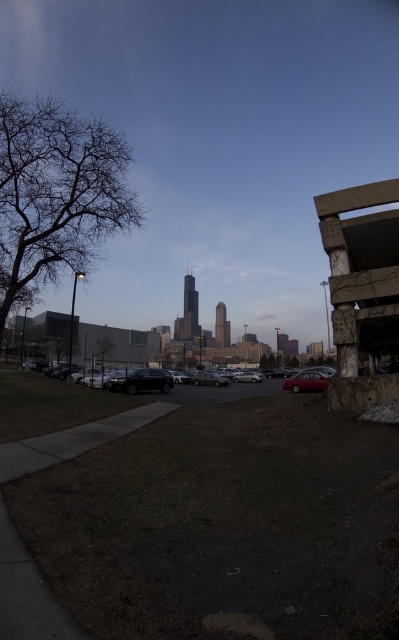
Question: Is brown dirt at lower center closer to camera compared to concrete textured bench at right?

Choices:
 (A) no
 (B) yes

Answer: (B)

Question: Does concrete textured bench at right have a smaller size compared to metallic gray cars at center?

Choices:
 (A) no
 (B) yes

Answer: (B)

Question: Which of these objects is positioned farthest from the matte red sedan at center-right?

Choices:
 (A) concrete textured bench at right
 (B) green leafy tree at center-left
 (C) brown dirt at lower center
 (D) bare branches at left

Answer: (B)

Question: Among these points, which one is nearest to the camera?

Choices:
 (A) (191, 509)
 (B) (314, 372)
 (C) (120, 385)
 (D) (98, 362)

Answer: (A)

Question: Which of these objects is positioned closest to the matte red sedan at center-right?

Choices:
 (A) green leafy tree at center-left
 (B) brown dirt at lower center
 (C) metallic gray cars at center
 (D) shiny black suv at center

Answer: (B)

Question: Does bare branches at left appear on the right side of green leafy tree at center-left?

Choices:
 (A) yes
 (B) no

Answer: (A)